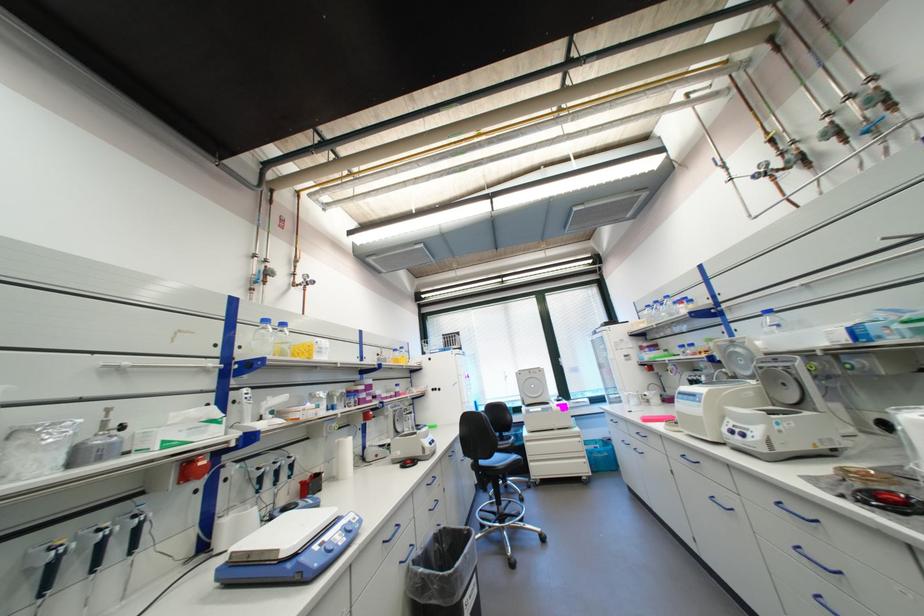
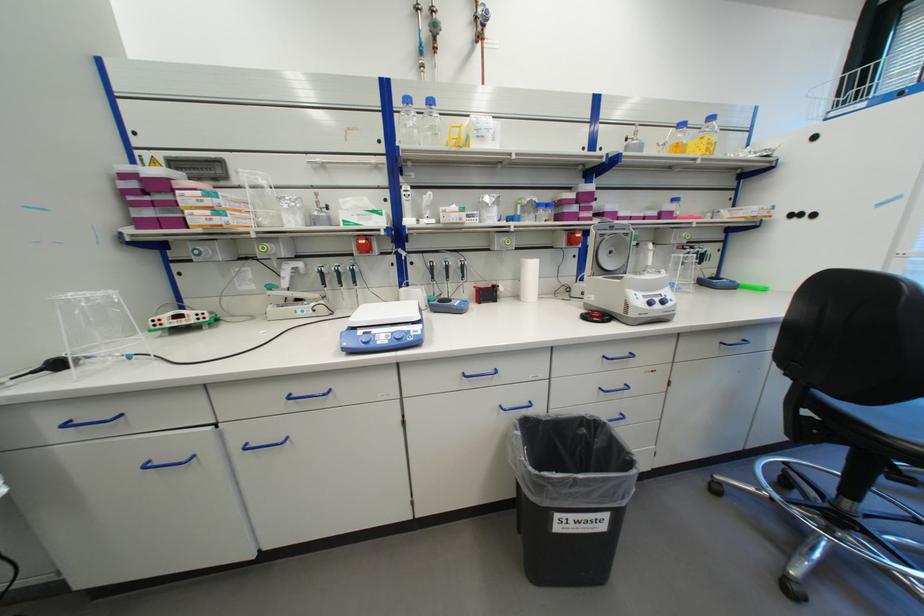
In the second image, find the point that corresponds to the point at 283,323 in the first image.

(428, 103)